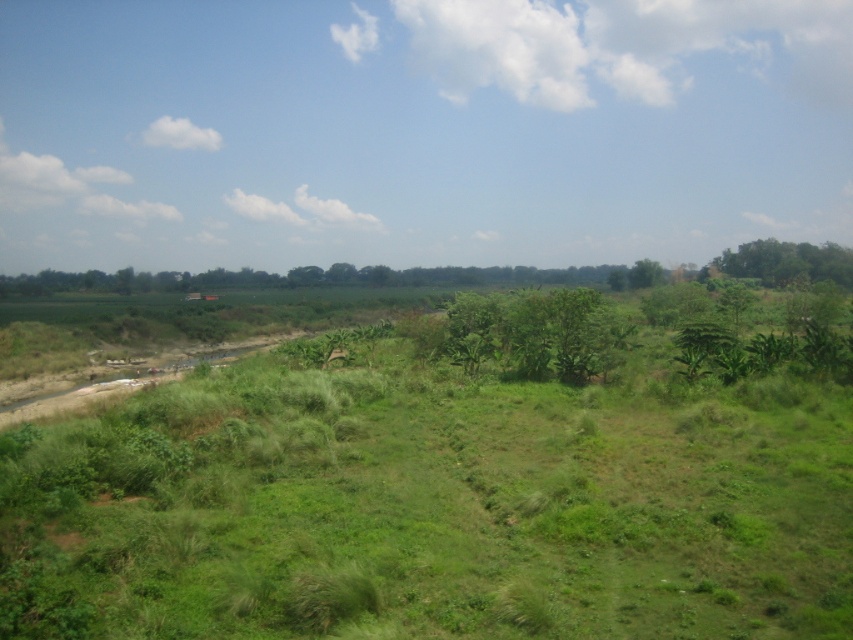
Question: Which point is farther to the camera?

Choices:
 (A) green leafy tree at upper right
 (B) green leafy tree at center

Answer: (A)

Question: Which point is closer to the camera?

Choices:
 (A) (456, 348)
 (B) (828, 246)

Answer: (A)

Question: Does green leafy tree at center appear under green leafy tree at upper right?

Choices:
 (A) yes
 (B) no

Answer: (A)

Question: Which point is farther to the camera?

Choices:
 (A) green leafy tree at upper right
 (B) green leafy tree at center

Answer: (A)

Question: Can you confirm if green leafy tree at center is bigger than green leafy tree at upper right?

Choices:
 (A) no
 (B) yes

Answer: (A)

Question: Does green leafy tree at center appear on the left side of green leafy tree at upper right?

Choices:
 (A) yes
 (B) no

Answer: (A)